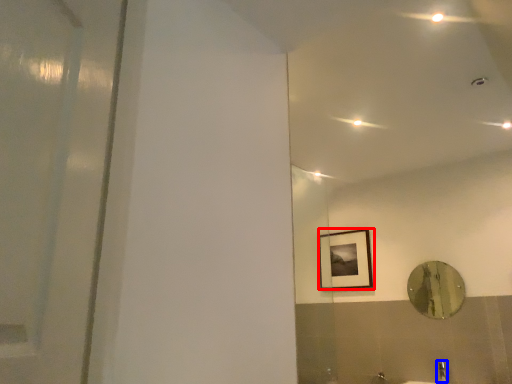
Question: Among these objects, which one is farthest to the camera, picture frame (highlighted by a red box) or faucet (highlighted by a blue box)?

Choices:
 (A) picture frame
 (B) faucet

Answer: (A)